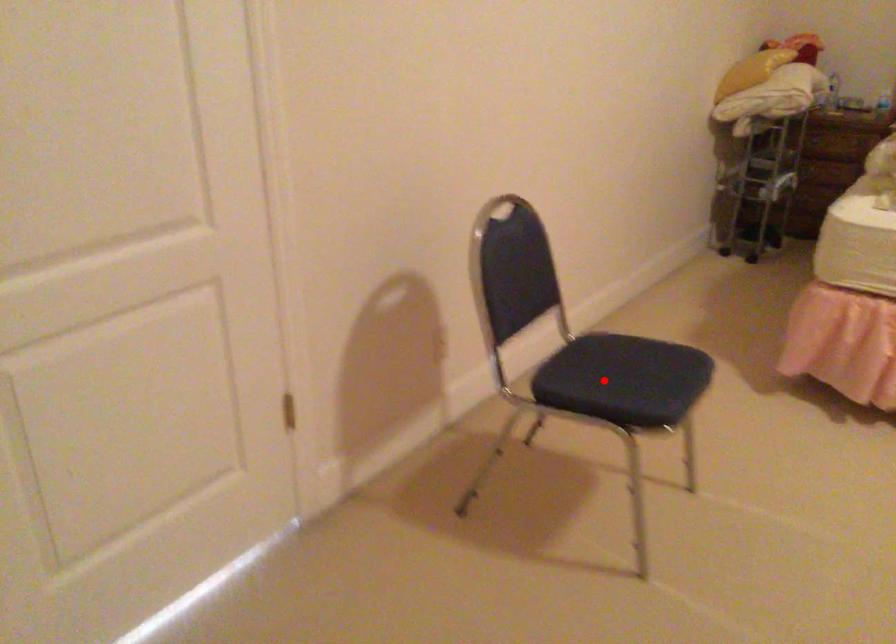
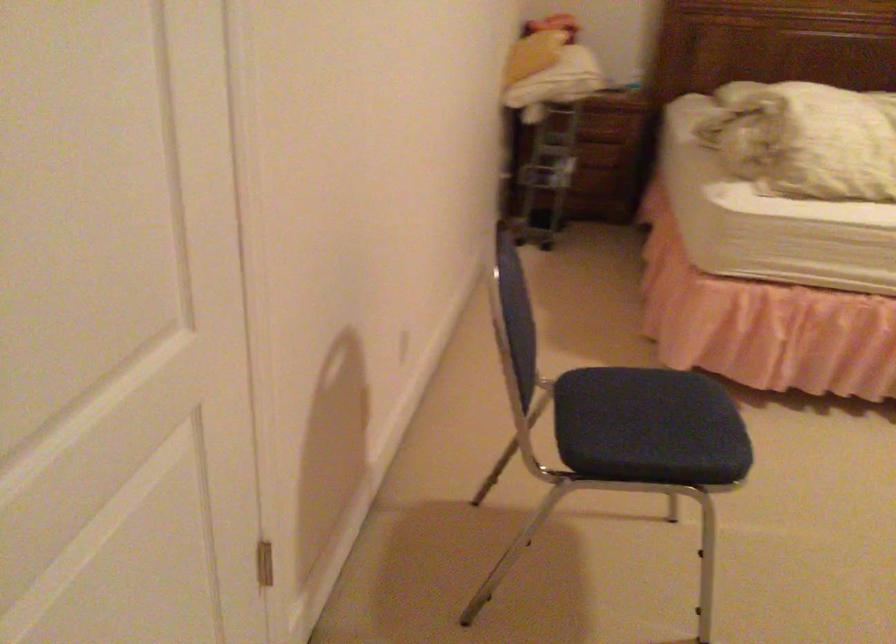
Question: I am providing you with two images of the same scene from different viewpoints. A red point is shown in image1. For the corresponding object point in image2, is it positioned nearer or farther from the camera?

Choices:
 (A) Nearer
 (B) Farther

Answer: (A)